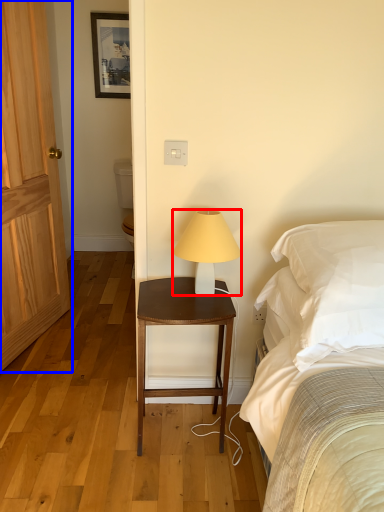
Question: Which of the following is the closest to the observer, lamp (highlighted by a red box) or door (highlighted by a blue box)?

Choices:
 (A) lamp
 (B) door

Answer: (A)